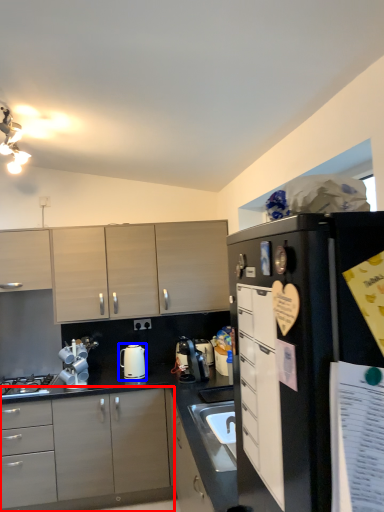
Question: Which object appears closest to the camera in this image, cabinetry (highlighted by a red box) or kitchen appliance (highlighted by a blue box)?

Choices:
 (A) cabinetry
 (B) kitchen appliance

Answer: (A)